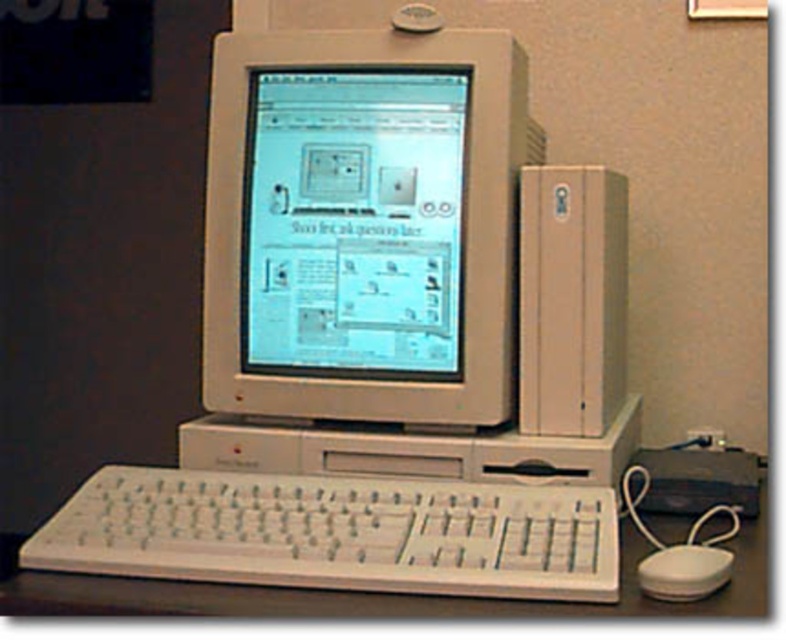
The height and width of the screenshot is (640, 786). In order to click on metallic silver tower at right in this screenshot , I will do (571, 298).

Does metallic silver tower at right have a larger size compared to white plastic mouse at lower right?

Correct, metallic silver tower at right is larger in size than white plastic mouse at lower right.

I want to click on metallic silver tower at right, so click(571, 298).

Identify the location of metallic silver tower at right. This screenshot has height=640, width=786. (571, 298).

Does point (310, 227) come farther from viewer compared to point (534, 428)?

Yes, point (310, 227) is behind point (534, 428).

Does white plastic monitor at center have a greater width compared to metallic silver tower at right?

Yes.

Does point (465, 204) lie behind point (520, 248)?

Yes, point (465, 204) is behind point (520, 248).

The width and height of the screenshot is (786, 640). I want to click on white plastic monitor at center, so click(x=362, y=225).

Is white plastic monitor at center smaller than white plastic mouse at lower right?

No, white plastic monitor at center is not smaller than white plastic mouse at lower right.

Is white plastic monitor at center closer to camera compared to white plastic mouse at lower right?

No.

Which is in front, point (371, 234) or point (713, 554)?

Point (713, 554)

Identify the location of white plastic monitor at center. (362, 225).